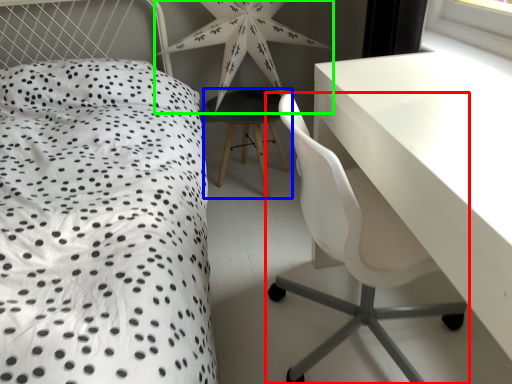
Question: Which object is positioned farthest from chair (highlighted by a red box)? Select from bar stool (highlighted by a blue box) and star (highlighted by a green box).

Choices:
 (A) bar stool
 (B) star

Answer: (B)